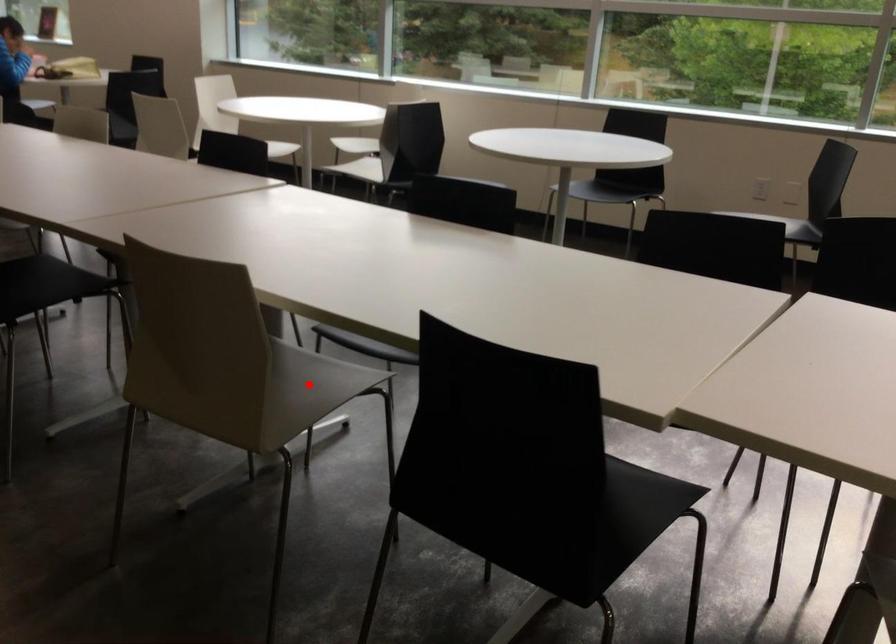
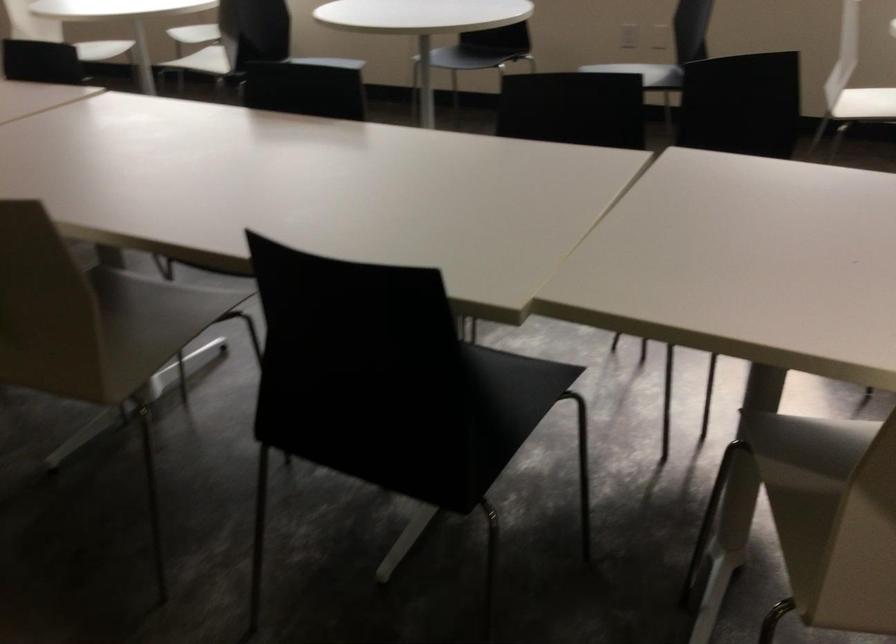
Find the pixel in the second image that matches the highlighted location in the first image.

(159, 317)